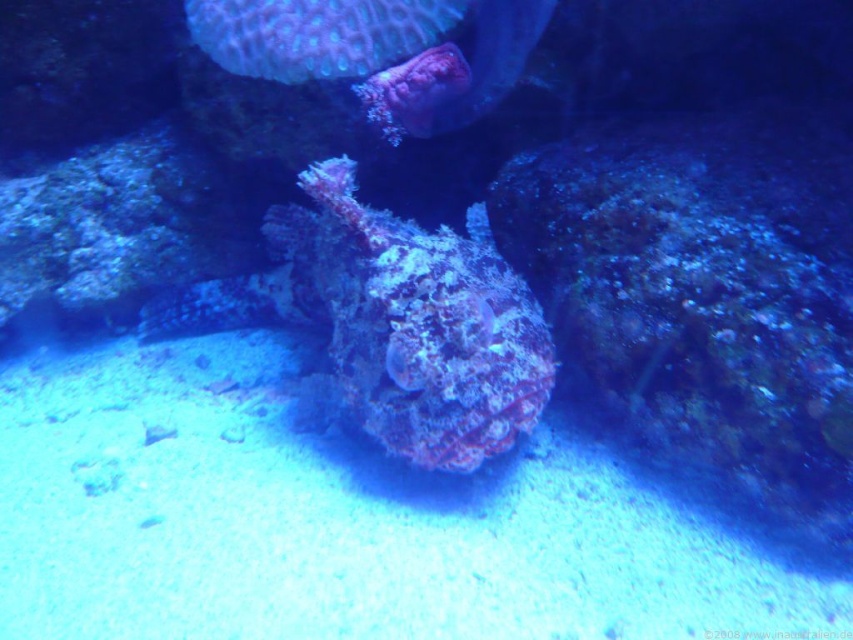
Question: Estimate the real-world distances between objects in this image. Which object is closer to the smooth coral at upper center?

Choices:
 (A) speckled coral at center
 (B) teal textured coral at upper center

Answer: (B)

Question: Which point is closer to the camera taking this photo?

Choices:
 (A) (424, 371)
 (B) (515, 38)

Answer: (A)

Question: Can you confirm if speckled coral at center is positioned to the left of smooth coral at upper center?

Choices:
 (A) yes
 (B) no

Answer: (A)

Question: Can you confirm if speckled coral at center is wider than smooth coral at upper center?

Choices:
 (A) yes
 (B) no

Answer: (A)

Question: Is speckled coral at center to the left of smooth coral at upper center from the viewer's perspective?

Choices:
 (A) yes
 (B) no

Answer: (A)

Question: Which point is farther to the camera?

Choices:
 (A) (310, 36)
 (B) (357, 248)
 (C) (404, 124)

Answer: (C)